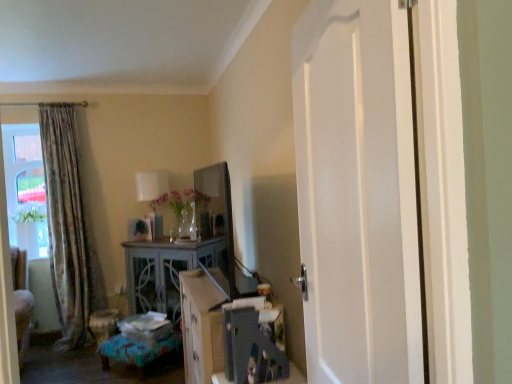
Question: Is clear glass vase at center wider than textured blue fabric ottoman at lower center?

Choices:
 (A) no
 (B) yes

Answer: (A)

Question: Is clear glass vase at center oriented away from textured blue fabric ottoman at lower center?

Choices:
 (A) no
 (B) yes

Answer: (A)

Question: Is clear glass vase at center surrounding textured blue fabric ottoman at lower center?

Choices:
 (A) yes
 (B) no

Answer: (B)

Question: From the image's perspective, is clear glass vase at center below textured blue fabric ottoman at lower center?

Choices:
 (A) no
 (B) yes

Answer: (A)

Question: Does clear glass vase at center come in front of textured blue fabric ottoman at lower center?

Choices:
 (A) yes
 (B) no

Answer: (B)

Question: Is clear glass vase at center directly adjacent to textured blue fabric ottoman at lower center?

Choices:
 (A) yes
 (B) no

Answer: (B)

Question: From a real-world perspective, is distressed wood cabinet at center below textured blue fabric ottoman at lower center?

Choices:
 (A) no
 (B) yes

Answer: (A)

Question: From a real-world perspective, does distressed wood cabinet at center stand above textured blue fabric ottoman at lower center?

Choices:
 (A) no
 (B) yes

Answer: (B)

Question: Considering the relative sizes of distressed wood cabinet at center and textured blue fabric ottoman at lower center in the image provided, is distressed wood cabinet at center bigger than textured blue fabric ottoman at lower center?

Choices:
 (A) no
 (B) yes

Answer: (B)

Question: Is distressed wood cabinet at center positioned beyond the bounds of textured blue fabric ottoman at lower center?

Choices:
 (A) yes
 (B) no

Answer: (A)

Question: Is textured blue fabric ottoman at lower center inside distressed wood cabinet at center?

Choices:
 (A) no
 (B) yes

Answer: (A)

Question: From the image's perspective, is distressed wood cabinet at center below textured blue fabric ottoman at lower center?

Choices:
 (A) no
 (B) yes

Answer: (A)

Question: From a real-world perspective, is floral fabric curtain at left on top of white fabric lampshade at upper center?

Choices:
 (A) yes
 (B) no

Answer: (B)